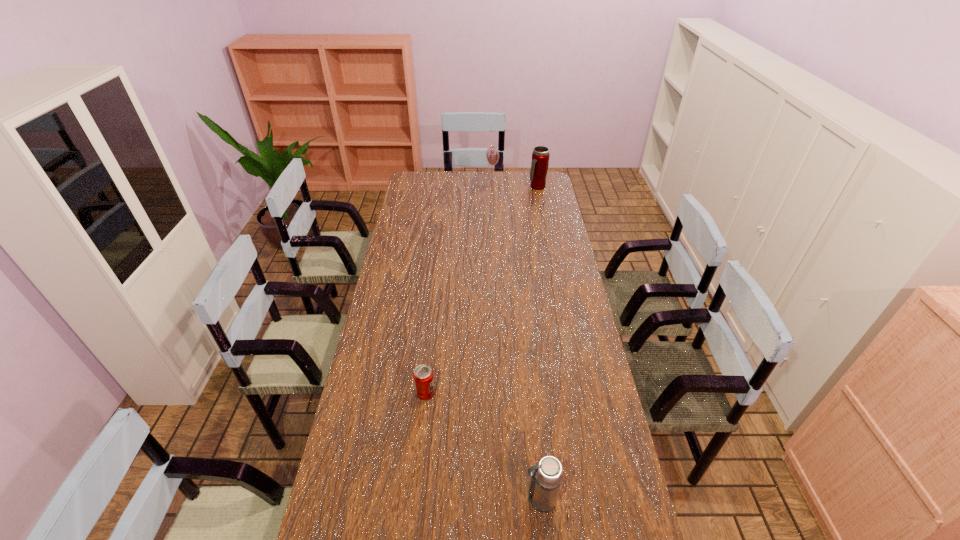
Find the location of a particular element. free space located 0.140m with a handle on the side of the left thermos bottle is located at coordinates (471, 499).

Where is `blank space located with a handle on the side of the left thermos bottle`? The image size is (960, 540). blank space located with a handle on the side of the left thermos bottle is located at coordinates (384, 499).

Find the location of a particular element. This screenshot has width=960, height=540. free spot located 0.200m on the back of the leftmost object is located at coordinates (432, 339).

Identify the location of thermos bottle that is at the far edge. (540, 157).

Find the location of a particular element. The image size is (960, 540). wineglass that is at the far edge is located at coordinates (492, 154).

In order to click on object that is at the right edge in this screenshot , I will do `click(540, 157)`.

You are a GUI agent. You are given a task and a screenshot of the screen. Output one action in this format:
    pyautogui.click(x=<x>, y=<y>)
    Task: Click on the object positioned at the far right corner
    The width and height of the screenshot is (960, 540).
    Given the screenshot: What is the action you would take?
    pyautogui.click(x=540, y=157)

Image resolution: width=960 pixels, height=540 pixels. In order to click on free space at the far edge of the desktop in this screenshot , I will do `click(467, 178)`.

Where is `vacant space at the left edge of the desktop`? vacant space at the left edge of the desktop is located at coordinates (434, 195).

Where is `vacant area at the right edge of the desktop`? The width and height of the screenshot is (960, 540). vacant area at the right edge of the desktop is located at coordinates (538, 271).